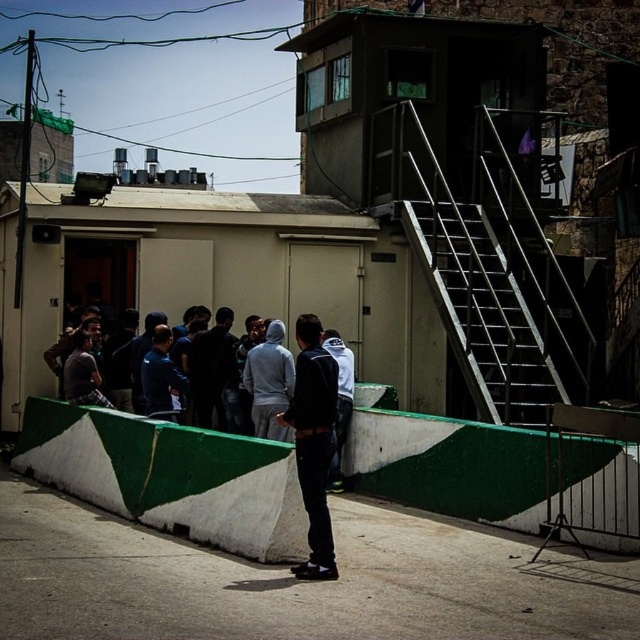
Question: Does dark blue hoodie at center have a greater width compared to white matte jacket at center?

Choices:
 (A) no
 (B) yes

Answer: (B)

Question: Does dark blue jeans at center have a greater width compared to white matte jacket at center?

Choices:
 (A) no
 (B) yes

Answer: (B)

Question: Among these points, which one is nearest to the camera?

Choices:
 (A) (352, 385)
 (B) (321, 461)
 (C) (225, 422)

Answer: (B)

Question: Which of the following is the farthest from the observer?

Choices:
 (A) (193, 396)
 (B) (316, 387)

Answer: (A)

Question: Considering the relative positions of dark blue jeans at center and dark blue hoodie at center in the image provided, where is dark blue jeans at center located with respect to dark blue hoodie at center?

Choices:
 (A) above
 (B) below

Answer: (B)

Question: Which of the following is the farthest from the observer?

Choices:
 (A) (324, 513)
 (B) (333, 346)
 (C) (228, 323)

Answer: (C)